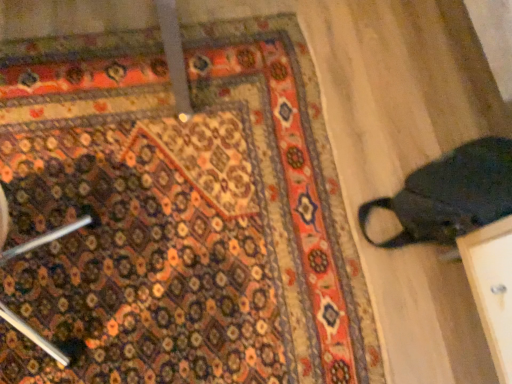
Where is `vacant space behind dark fabric bag at right`? vacant space behind dark fabric bag at right is located at coordinates (426, 92).